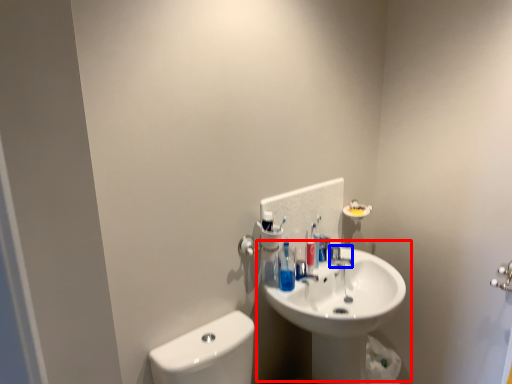
Question: Which object is further to the camera taking this photo, sink (highlighted by a red box) or plumbing fixture (highlighted by a blue box)?

Choices:
 (A) sink
 (B) plumbing fixture

Answer: (B)